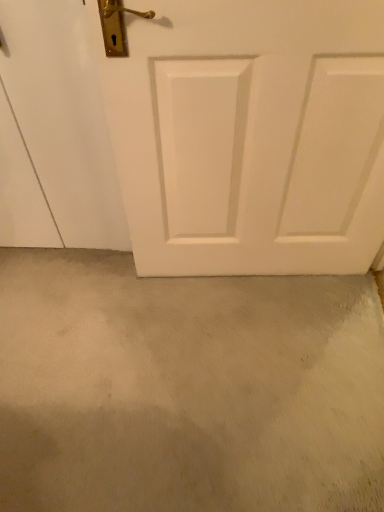
What do you see at coordinates (249, 135) in the screenshot?
I see `white matte door at center` at bounding box center [249, 135].

In order to click on white matte door at center in this screenshot , I will do click(x=249, y=135).

Find the location of a particular element. white matte door at center is located at coordinates (249, 135).